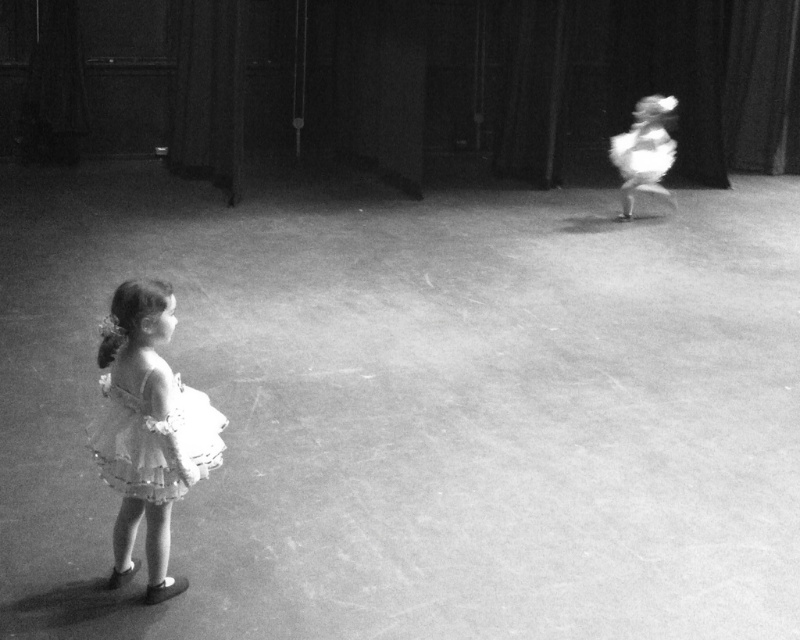
You are standing in the dance studio and see a point marked at coordinates (98,364). If you walk directly towards it, how far will you have to walk?

The point at (98,364) is 3.47 meters away from the viewer, so you will have to walk 3.47 meters to reach it.

In the black and white photo of the dance studio, there is a young girl in a light colored frilly dress and a white fluffy tutu at upper right. Based on their positions, which object is closer to the top edge of the photo?

The white fluffy tutu at upper right is closer to the top edge of the photo because its 2D location at point [644,150] places it higher up in the frame.

You are standing in the dance studio and see two points marked on the floor. The first point is at coordinates point (141, 499) and the second is at point (634, 134). Which point is closer to you?

Point (141, 499) is closer to the viewer than point (634, 134).